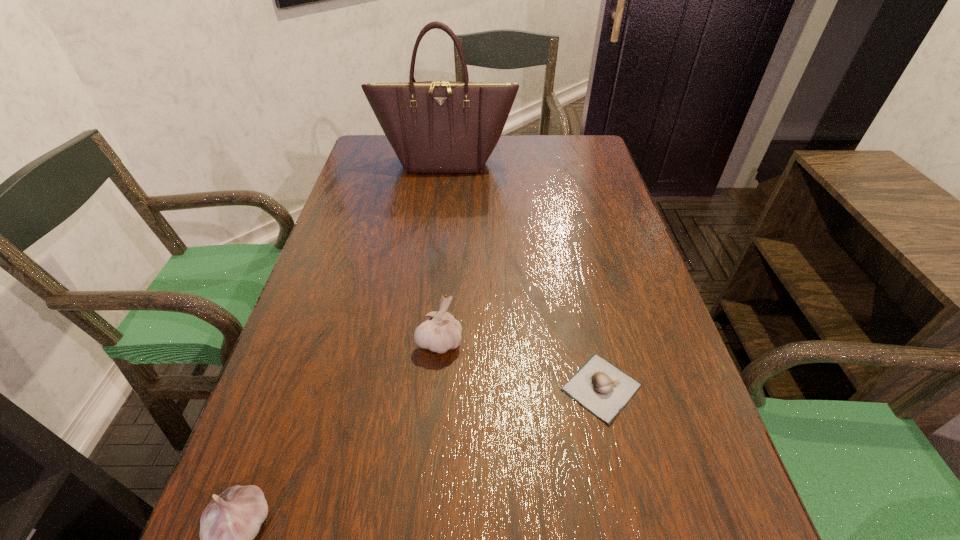
Where is `free location that satisfies the following two spatial constraints: 1. on the front-facing side of the farthest object; 2. on the right side of the rightmost object`? free location that satisfies the following two spatial constraints: 1. on the front-facing side of the farthest object; 2. on the right side of the rightmost object is located at coordinates (420, 387).

Find the location of a particular element. Image resolution: width=960 pixels, height=540 pixels. free space that satisfies the following two spatial constraints: 1. on the front-facing side of the second garlic from right to left; 2. on the right side of the tallest object is located at coordinates (424, 342).